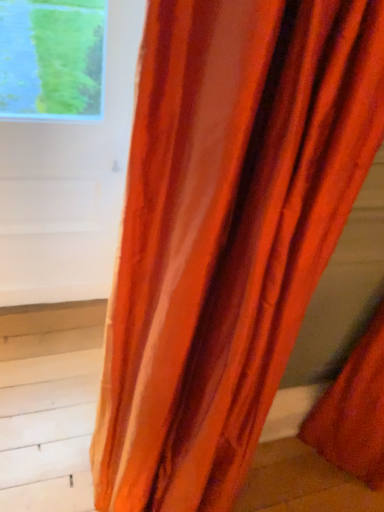
Image resolution: width=384 pixels, height=512 pixels. Describe the element at coordinates (69, 185) in the screenshot. I see `white glossy screen door at upper left` at that location.

From the picture: What is the approximate height of white glossy screen door at upper left?

The height of white glossy screen door at upper left is 1.08 meters.

Locate an element on the screen. The image size is (384, 512). white glossy screen door at upper left is located at coordinates (69, 185).

Locate an element on the screen. white glossy screen door at upper left is located at coordinates click(x=69, y=185).